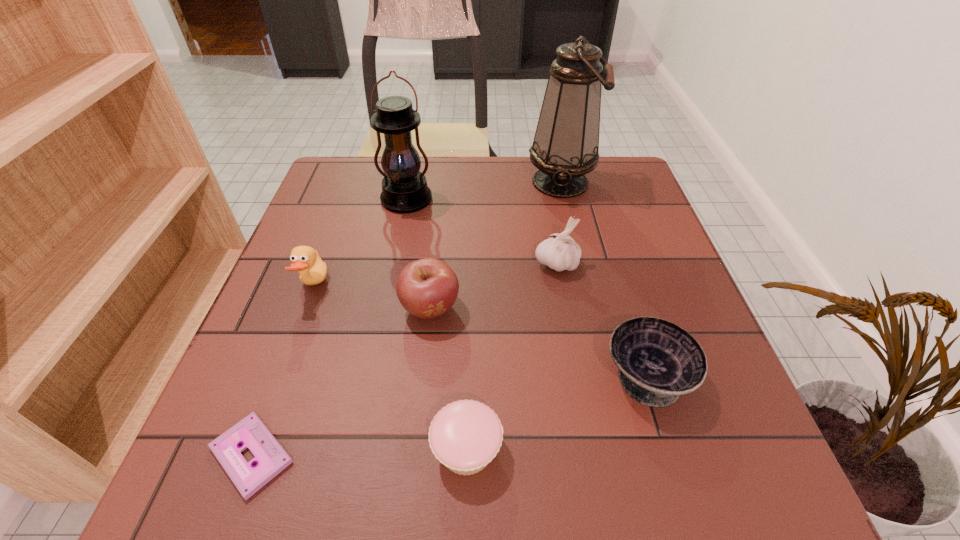
Where is `duck located in the left edge section of the desktop`? This screenshot has width=960, height=540. duck located in the left edge section of the desktop is located at coordinates (306, 260).

Identify the location of videotape at the left edge. pyautogui.click(x=270, y=458).

Identify the location of oil lamp present at the right edge. Image resolution: width=960 pixels, height=540 pixels. (566, 143).

Locate an element on the screen. This screenshot has height=540, width=960. bowl present at the right edge is located at coordinates (658, 361).

Image resolution: width=960 pixels, height=540 pixels. In order to click on object positioned at the near left corner in this screenshot , I will do `click(270, 458)`.

Locate an element on the screen. object that is at the far right corner is located at coordinates (566, 143).

In the image, there is a desktop. At what (x,y) coordinates should I click in order to perform the action: click on vacant space at the far edge. Please return your answer as a coordinate pair (x, y). The height and width of the screenshot is (540, 960). Looking at the image, I should click on (512, 172).

At what (x,y) coordinates should I click in order to perform the action: click on free space at the near edge of the desktop. Please return your answer as a coordinate pair (x, y). Image resolution: width=960 pixels, height=540 pixels. Looking at the image, I should click on (353, 494).

Where is `vacant space at the left edge of the desktop`? The height and width of the screenshot is (540, 960). vacant space at the left edge of the desktop is located at coordinates (276, 306).

The height and width of the screenshot is (540, 960). In order to click on vacant region at the right edge in this screenshot , I will do `click(589, 206)`.